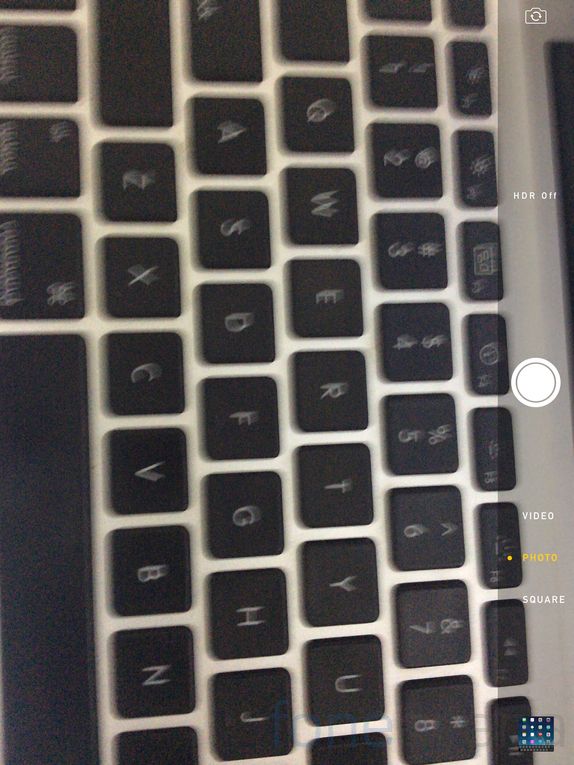
The height and width of the screenshot is (765, 574). Find the location of `laptop keyboard`. laptop keyboard is located at coordinates (280, 388).